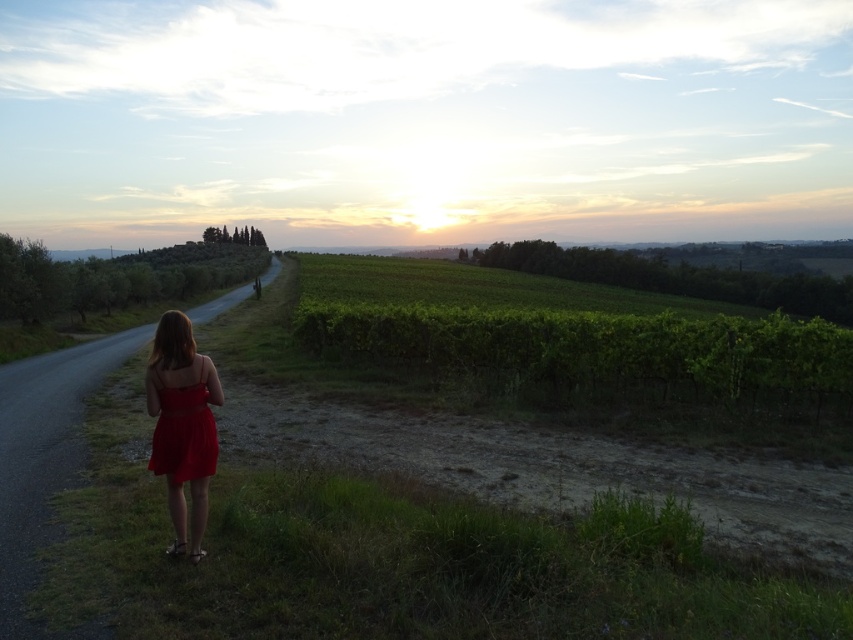
Question: Considering the relative positions of green leafy vineyard at center and matte red dress at back in the image provided, where is green leafy vineyard at center located with respect to matte red dress at back?

Choices:
 (A) above
 (B) below

Answer: (A)

Question: Can you confirm if green leafy vineyard at center is smaller than matte red dress at left?

Choices:
 (A) no
 (B) yes

Answer: (A)

Question: Estimate the real-world distances between objects in this image. Which object is farther from the matte red dress at back?

Choices:
 (A) matte red dress at left
 (B) green leafy vineyard at center

Answer: (B)

Question: Can you confirm if matte red dress at left is wider than matte red dress at back?

Choices:
 (A) no
 (B) yes

Answer: (B)

Question: Which point appears farthest from the camera in this image?

Choices:
 (A) (198, 492)
 (B) (370, 317)

Answer: (B)

Question: Estimate the real-world distances between objects in this image. Which object is farther from the matte red dress at left?

Choices:
 (A) matte red dress at back
 (B) green leafy vineyard at center

Answer: (B)